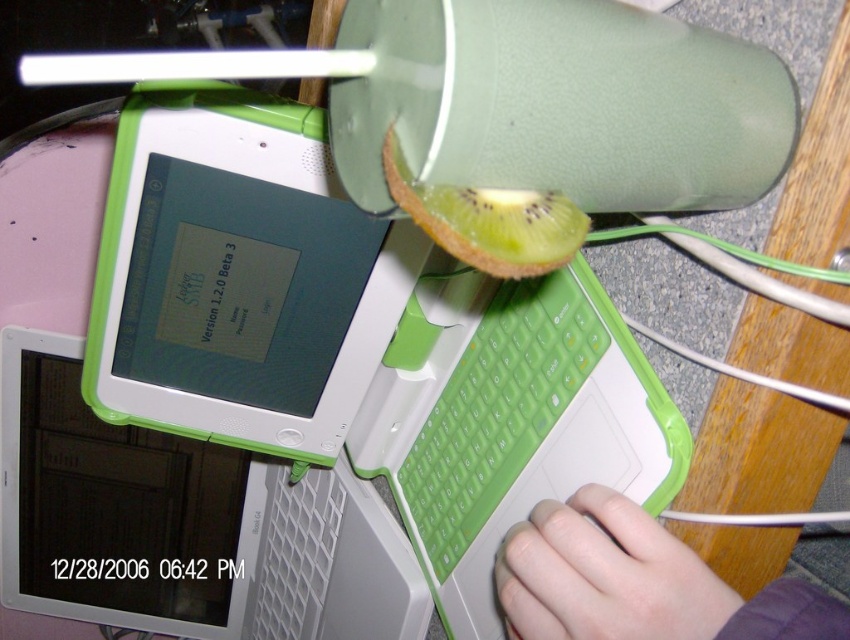
Question: Which point appears farthest from the camera in this image?

Choices:
 (A) (369, 355)
 (B) (446, 404)

Answer: (A)

Question: Is green plastic laptop at center closer to the viewer compared to green textured kiwi at upper center?

Choices:
 (A) no
 (B) yes

Answer: (A)

Question: Which of these objects is positioned farthest from the green textured kiwi at upper center?

Choices:
 (A) green plastic laptop at center
 (B) smooth skin hand at lower right
 (C) green rubberized keyboard at center

Answer: (A)

Question: Which point is farther from the camera taking this photo?

Choices:
 (A) (646, 632)
 (B) (123, 259)
 (C) (472, 372)

Answer: (C)

Question: Can you confirm if smooth skin hand at lower right is positioned above green rubberized keyboard at center?

Choices:
 (A) yes
 (B) no

Answer: (B)

Question: Is green plastic laptop at center thinner than smooth skin hand at lower right?

Choices:
 (A) yes
 (B) no

Answer: (B)